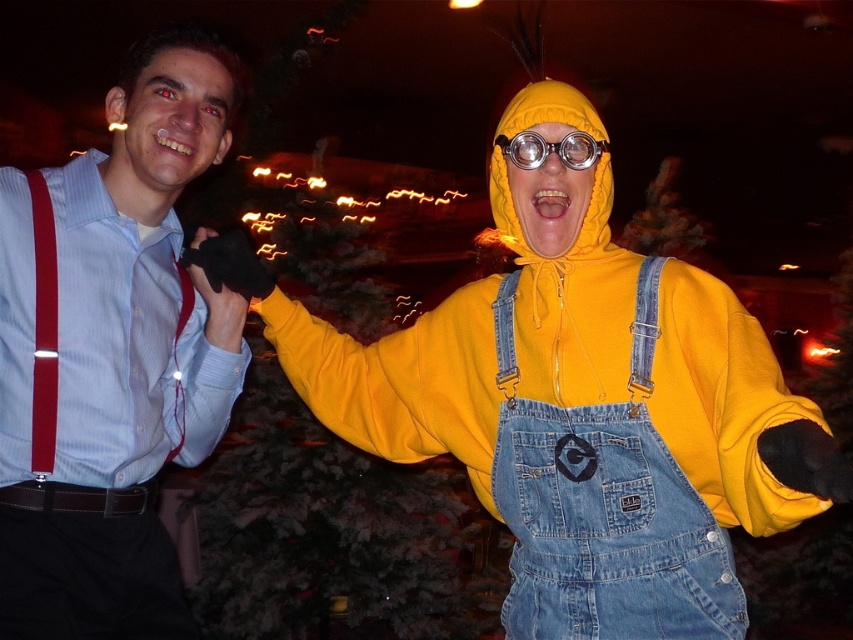
In the scene shown: Can you confirm if yellow fleece jacket at right is smaller than clear plastic goggles at center?

Incorrect, yellow fleece jacket at right is not smaller in size than clear plastic goggles at center.

Which is above, yellow fleece jacket at right or clear plastic goggles at center?

clear plastic goggles at center is higher up.

Is point (550, 369) positioned before point (584, 140)?

No, it is behind (584, 140).

Locate an element on the screen. yellow fleece jacket at right is located at coordinates (401, 380).

Can you confirm if brushed metal suspenders at left is positioned below clear plastic goggles at center?

Indeed, brushed metal suspenders at left is positioned under clear plastic goggles at center.

The width and height of the screenshot is (853, 640). What are the coordinates of `brushed metal suspenders at left` in the screenshot? It's located at (114, 353).

How distant is brushed metal suspenders at left from yellow fleece jacket at right?

brushed metal suspenders at left is 42.82 centimeters away from yellow fleece jacket at right.

Does brushed metal suspenders at left appear on the right side of yellow fleece jacket at right?

In fact, brushed metal suspenders at left is to the left of yellow fleece jacket at right.

The width and height of the screenshot is (853, 640). What are the coordinates of `brushed metal suspenders at left` in the screenshot? It's located at (114, 353).

You are a GUI agent. You are given a task and a screenshot of the screen. Output one action in this format:
    pyautogui.click(x=<x>, y=<y>)
    Task: Click on the brushed metal suspenders at left
    The width and height of the screenshot is (853, 640).
    Given the screenshot: What is the action you would take?
    pyautogui.click(x=114, y=353)